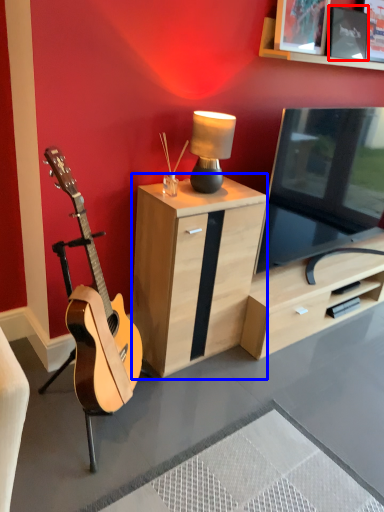
Question: Which object appears closest to the camera in this image, picture frame (highlighted by a red box) or cabinetry (highlighted by a blue box)?

Choices:
 (A) picture frame
 (B) cabinetry

Answer: (B)